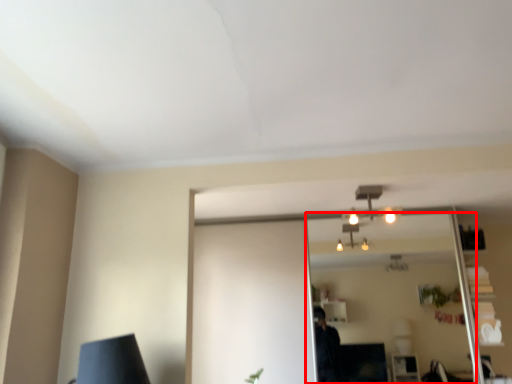
Question: Observing the image, what is the correct spatial positioning of mirror (annotated by the red box) in reference to fixture?

Choices:
 (A) left
 (B) right

Answer: (B)